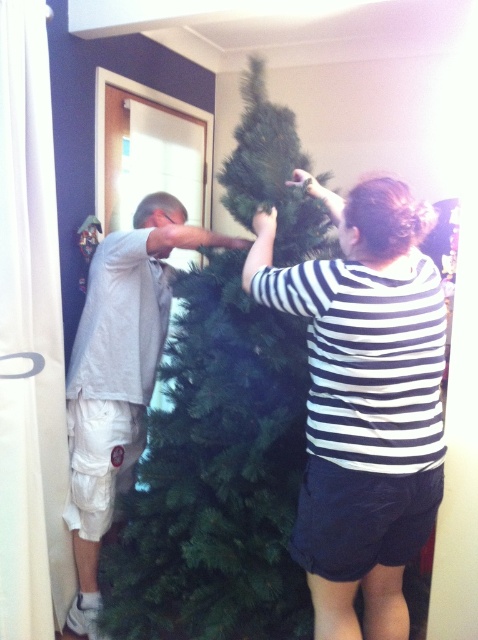
Question: Which object is the closest to the striped shirt at center?

Choices:
 (A) light gray t-shirt at left
 (B) green artificial christmas tree at center

Answer: (B)

Question: Which point is farther from the camera taking this photo?

Choices:
 (A) (278, 236)
 (B) (415, 426)

Answer: (A)

Question: Can you confirm if green artificial christmas tree at center is positioned above light gray t-shirt at left?

Choices:
 (A) yes
 (B) no

Answer: (A)

Question: Is green artificial christmas tree at center below striped shirt at center?

Choices:
 (A) no
 (B) yes

Answer: (A)

Question: Which object appears farthest from the camera in this image?

Choices:
 (A) striped shirt at center
 (B) light gray t-shirt at left

Answer: (B)

Question: Does green artificial christmas tree at center have a lesser width compared to striped shirt at center?

Choices:
 (A) yes
 (B) no

Answer: (B)